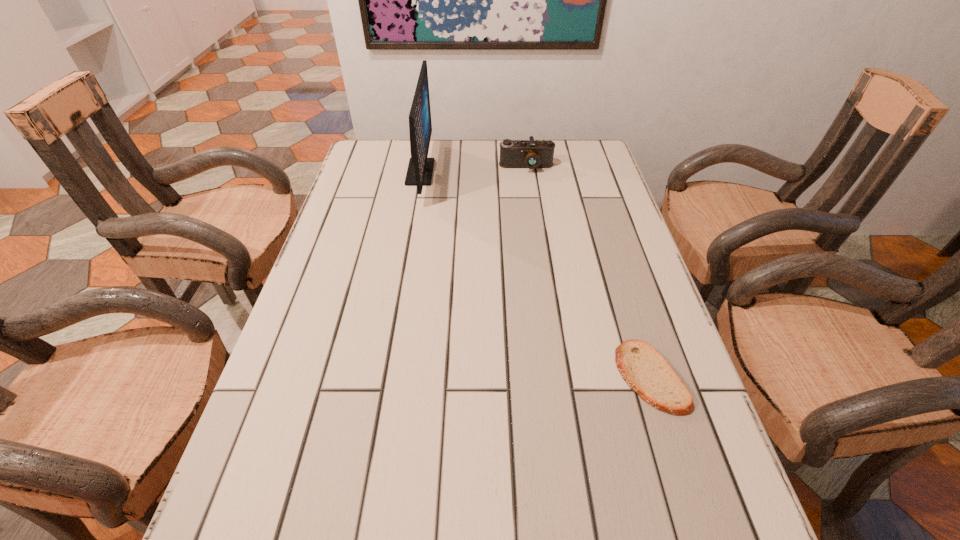
Locate an element on the screen. the tallest object is located at coordinates (420, 168).

This screenshot has height=540, width=960. I want to click on computer monitor, so (420, 168).

Locate an element on the screen. Image resolution: width=960 pixels, height=540 pixels. camera is located at coordinates (531, 154).

The height and width of the screenshot is (540, 960). In order to click on the second object from left to right in this screenshot , I will do `click(531, 154)`.

Identify the location of the nearest object. The width and height of the screenshot is (960, 540). (643, 368).

This screenshot has height=540, width=960. Identify the location of pita bread. (643, 368).

Image resolution: width=960 pixels, height=540 pixels. Identify the location of free space located 0.350m on the screen side of the computer monitor. 544,172.

Identify the location of vacant space located 0.170m on the lens of the second shortest object. Image resolution: width=960 pixels, height=540 pixels. (532, 206).

Where is `vacant space located 0.250m on the left of the pita bread`? The width and height of the screenshot is (960, 540). vacant space located 0.250m on the left of the pita bread is located at coordinates (490, 377).

You are a GUI agent. You are given a task and a screenshot of the screen. Output one action in this format:
    pyautogui.click(x=<x>, y=<y>)
    Task: Click on the computer monitor present at the far edge
    The image size is (960, 540).
    Given the screenshot: What is the action you would take?
    pyautogui.click(x=420, y=168)